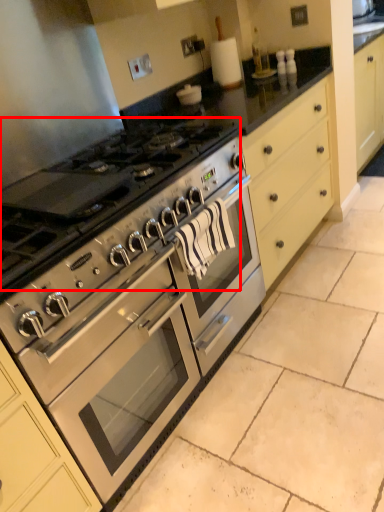
Question: Considering the relative positions of gas stove (annotated by the red box) and oven in the image provided, where is gas stove (annotated by the red box) located with respect to the staircase?

Choices:
 (A) left
 (B) right

Answer: (A)